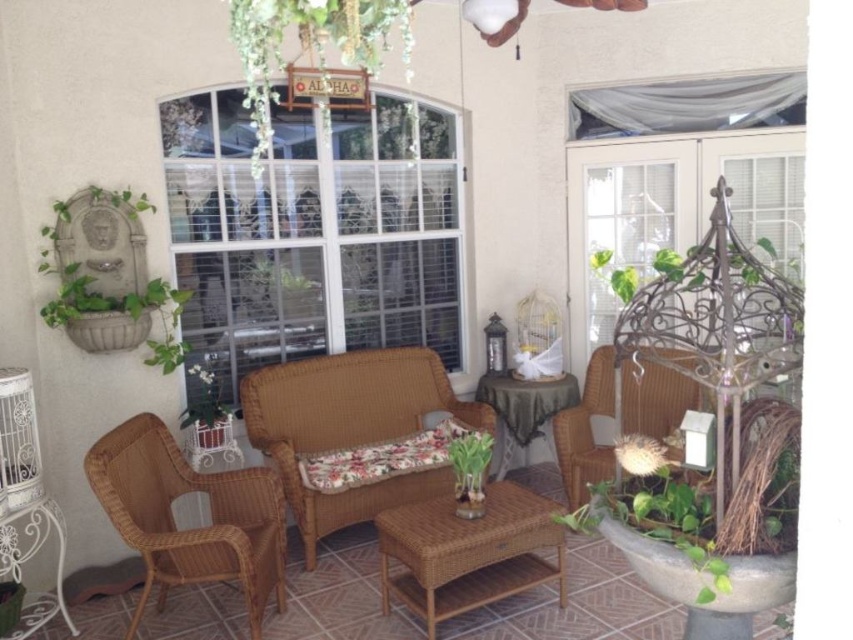
From the picture: You are sitting in the sunroom and want to place a small decorative item on the surface closest to you between the green glossy vase at center and the green leafy plant at center. Which object should you place it on?

You should place the item on the green glossy vase at center because it is in front of the green leafy plant at center, making it closer to you.

You are arranging flowers in the sunroom and need to place the green glossy vase at center and the green wicker basket at lower left. Which object is taller?

The green wicker basket at lower left is taller than the green glossy vase at center.